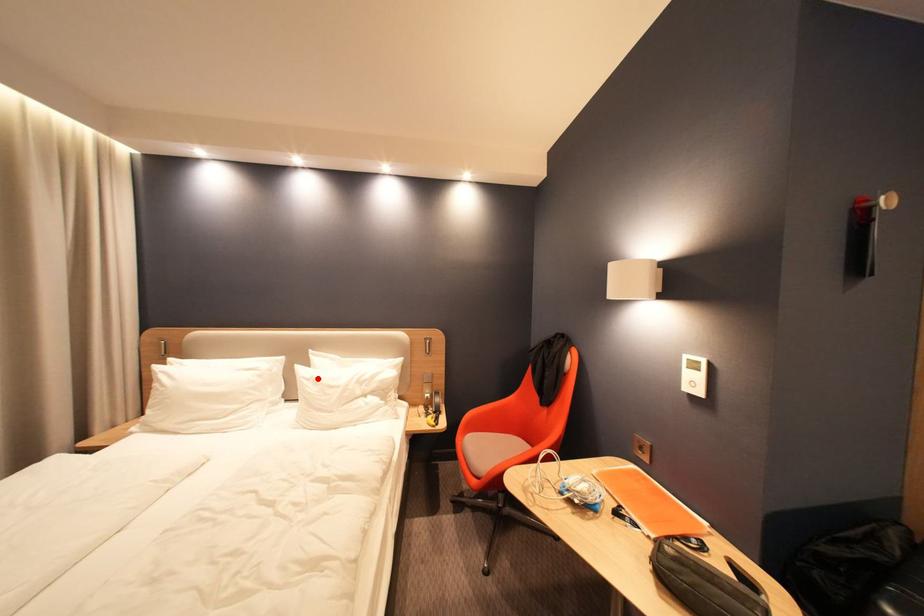
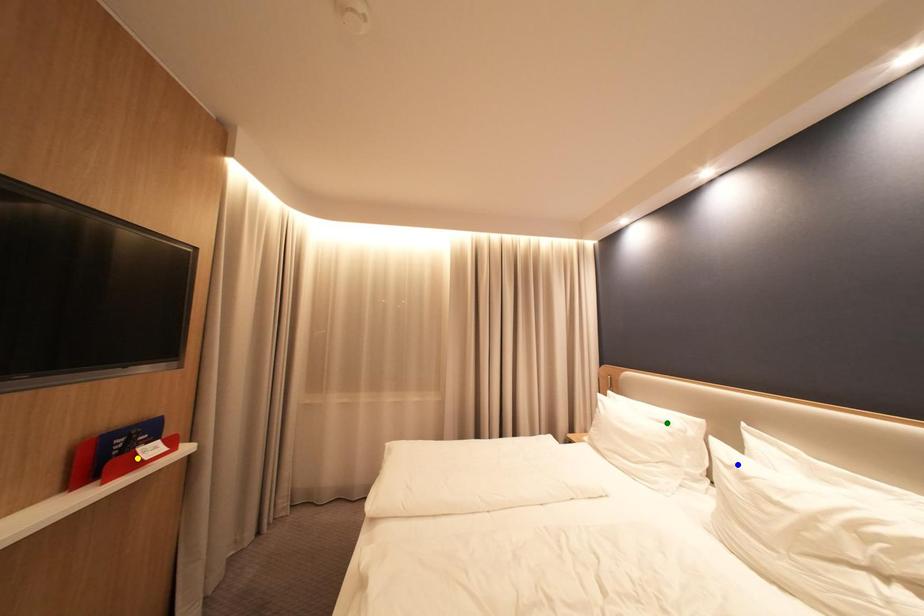
Question: I am providing you with two images of the same scene from different viewpoints. A red point is marked on the first image. You are given multiple points on the second image. In image 2, which mark is for the same physical point as the one in image 1?

Choices:
 (A) green point
 (B) blue point
 (C) yellow point

Answer: (B)